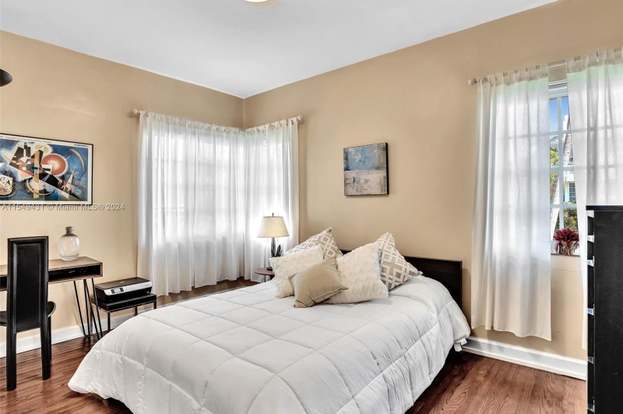
The image size is (623, 414). Find the location of `pillows`. pillows is located at coordinates (308, 281), (297, 261), (352, 266), (391, 260), (321, 238).